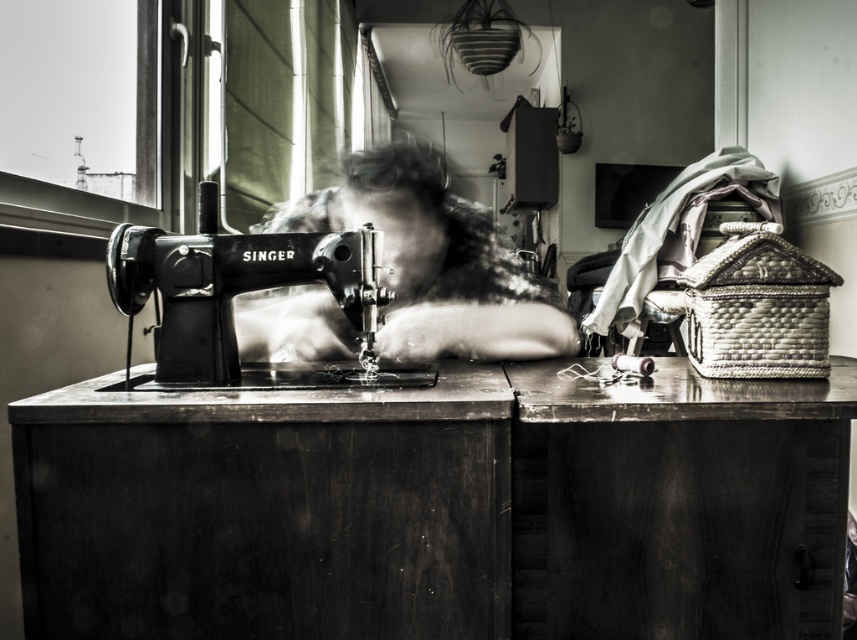
Is point (699, 596) in front of point (213, 189)?

No, it is behind (213, 189).

Can you confirm if wooden table at lower right is wider than metallic singer sewing machine at center?

Yes, wooden table at lower right is wider than metallic singer sewing machine at center.

Image resolution: width=857 pixels, height=640 pixels. I want to click on wooden table at lower right, so click(676, 502).

Where is `wooden table at lower right`? Image resolution: width=857 pixels, height=640 pixels. wooden table at lower right is located at coordinates (676, 502).

Which is behind, point (754, 404) or point (387, 356)?

Point (387, 356)

Is point (565, 524) farther from camera compared to point (339, 356)?

No.

The width and height of the screenshot is (857, 640). In order to click on wooden table at lower right in this screenshot , I will do `click(676, 502)`.

Between smooth fabric woman at center and metallic singer sewing machine at center, which one appears on the right side from the viewer's perspective?

From the viewer's perspective, smooth fabric woman at center appears more on the right side.

Is smooth fabric woman at center closer to camera compared to metallic singer sewing machine at center?

No, smooth fabric woman at center is further to the viewer.

Is point (312, 198) behind point (157, 333)?

Yes, point (312, 198) is behind point (157, 333).

Locate an element on the screen. smooth fabric woman at center is located at coordinates (436, 262).